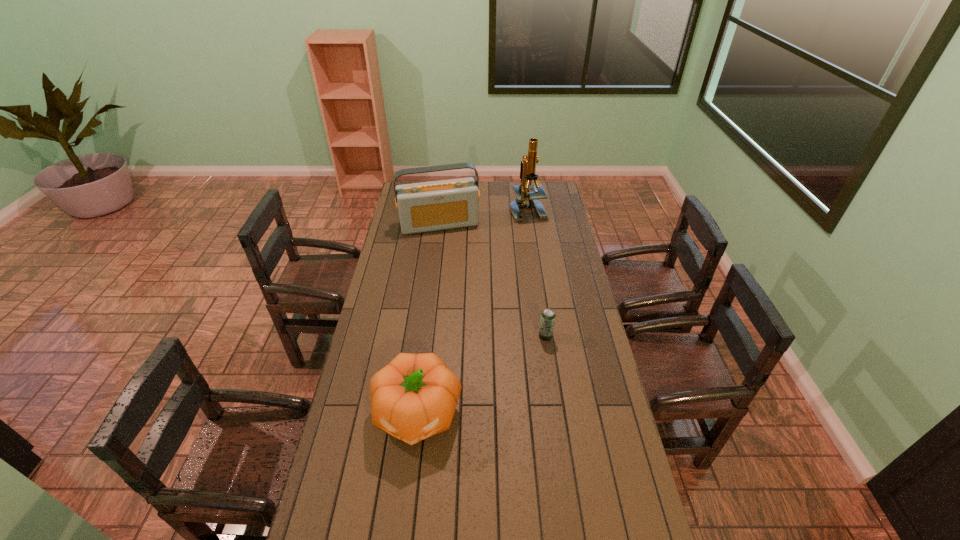
The height and width of the screenshot is (540, 960). In order to click on free location located on the front-facing side of the radio receiver in this screenshot , I will do `click(462, 284)`.

Where is `blank space located 0.280m at the eyepiece of the microscope`? blank space located 0.280m at the eyepiece of the microscope is located at coordinates [x=515, y=254].

The width and height of the screenshot is (960, 540). What are the coordinates of `free spot located at the eyepiece of the microscope` in the screenshot? It's located at (514, 255).

Locate an element on the screen. This screenshot has height=540, width=960. vacant space located at the eyepiece of the microscope is located at coordinates (518, 242).

At what (x,y) coordinates should I click in order to perform the action: click on object at the far edge. Please return your answer as a coordinate pair (x, y). The width and height of the screenshot is (960, 540). Looking at the image, I should click on (524, 199).

Find the location of `pumpkin that is at the left edge`. pumpkin that is at the left edge is located at coordinates (414, 397).

The width and height of the screenshot is (960, 540). Identify the location of radio receiver at the left edge. (437, 205).

Identify the location of object at the right edge. (524, 199).

Locate an element on the screen. Image resolution: width=960 pixels, height=540 pixels. object located in the far right corner section of the desktop is located at coordinates (524, 199).

Find the location of a particular element. This screenshot has width=960, height=540. vacant area at the far edge of the desktop is located at coordinates (504, 186).